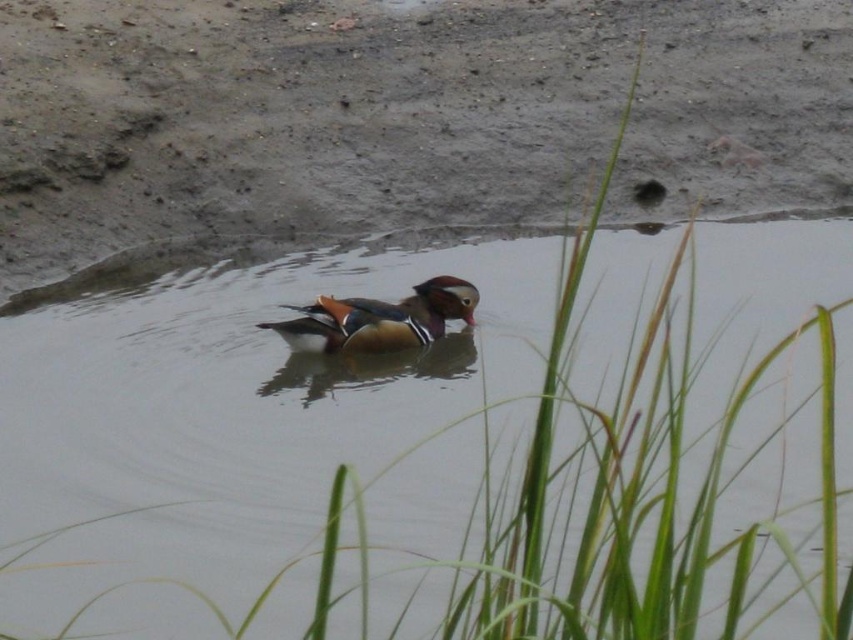
Is brown matte mud at center below shiny brown wood duck at center?

Incorrect, brown matte mud at center is not positioned below shiny brown wood duck at center.

Does brown matte mud at center appear over shiny brown wood duck at center?

Indeed, brown matte mud at center is positioned over shiny brown wood duck at center.

Describe the element at coordinates (397, 113) in the screenshot. I see `brown matte mud at center` at that location.

Where is `brown matte mud at center`? brown matte mud at center is located at coordinates (397, 113).